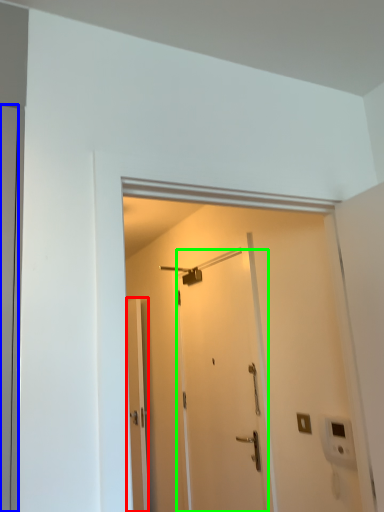
Question: Which object is positioned closest to door (highlighted by a red box)? Select from door (highlighted by a blue box) and door (highlighted by a green box).

Choices:
 (A) door
 (B) door

Answer: (B)